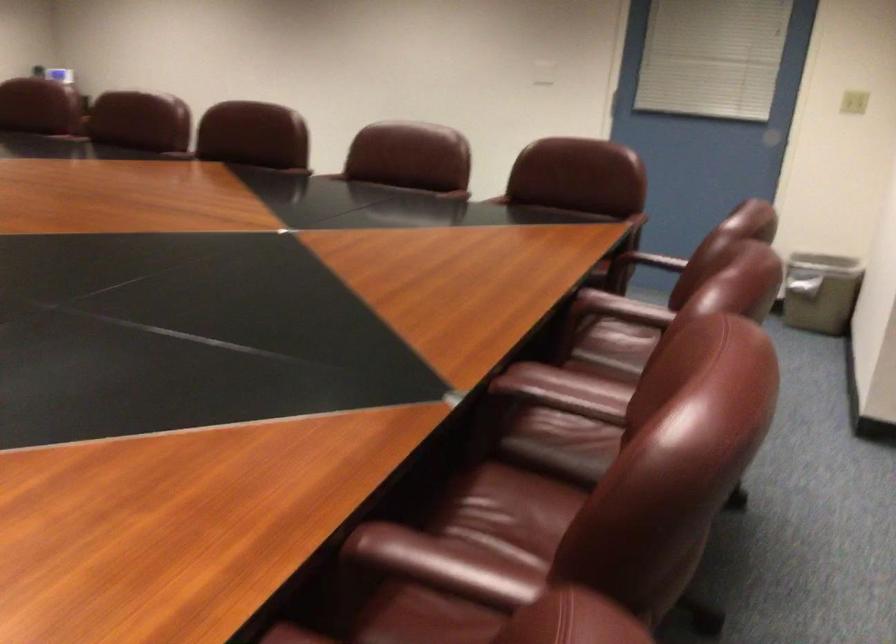
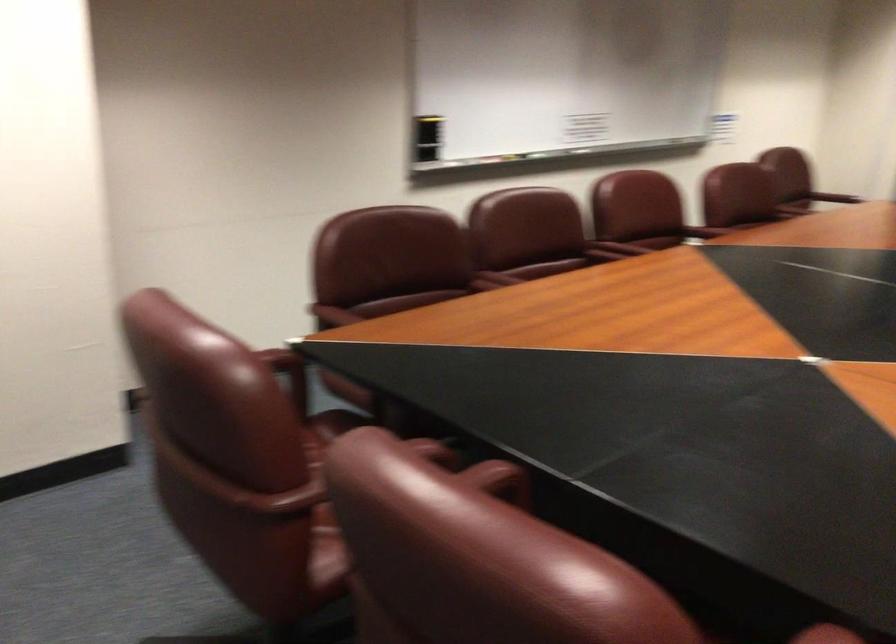
In the second image, find the point that corresponds to point 597,415 in the first image.

(618, 247)